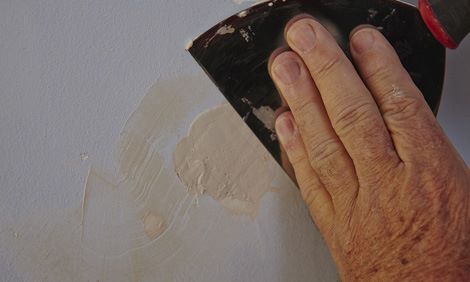
Locate an element on the screen. white wall is located at coordinates (72, 71).